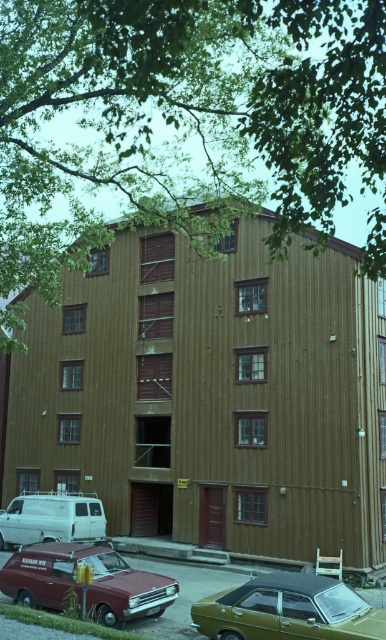
Question: Which object is closer to the camera taking this photo?

Choices:
 (A) metallic red van at lower left
 (B) white matte van at lower left
 (C) wooden building at center
 (D) metallic gold car at lower center

Answer: (D)

Question: Which is nearer to the white matte van at lower left?

Choices:
 (A) metallic gold car at lower center
 (B) metallic red van at lower left
 (C) wooden building at center

Answer: (C)

Question: Does metallic gold car at lower center appear under metallic red van at lower left?

Choices:
 (A) yes
 (B) no

Answer: (B)

Question: Can you confirm if metallic gold car at lower center is thinner than white matte van at lower left?

Choices:
 (A) no
 (B) yes

Answer: (B)

Question: Which point is farther to the camera?

Choices:
 (A) metallic gold car at lower center
 (B) metallic red van at lower left
 (C) white matte van at lower left

Answer: (C)

Question: Does wooden building at center appear over white matte van at lower left?

Choices:
 (A) yes
 (B) no

Answer: (A)